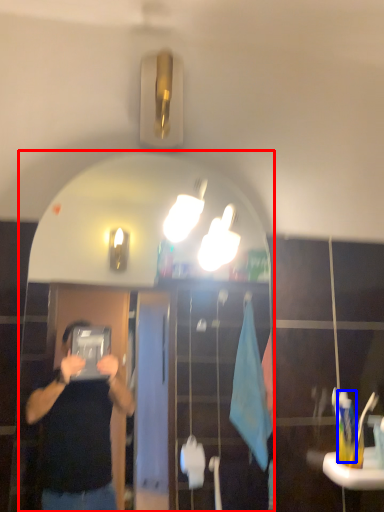
Question: Which point is further to the camera, mirror (highlighted by a red box) or toothbrush (highlighted by a blue box)?

Choices:
 (A) mirror
 (B) toothbrush

Answer: (B)